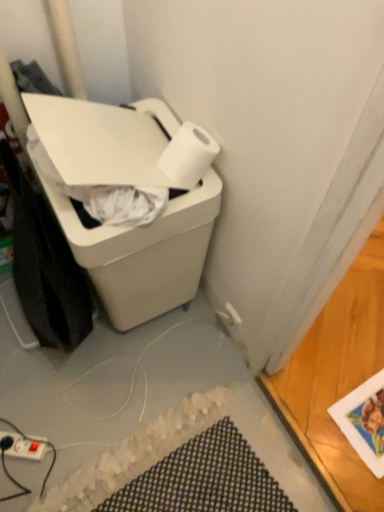
Find the location of `free spot behind matte white power plugs and sockets at lower left`. free spot behind matte white power plugs and sockets at lower left is located at coordinates (33, 389).